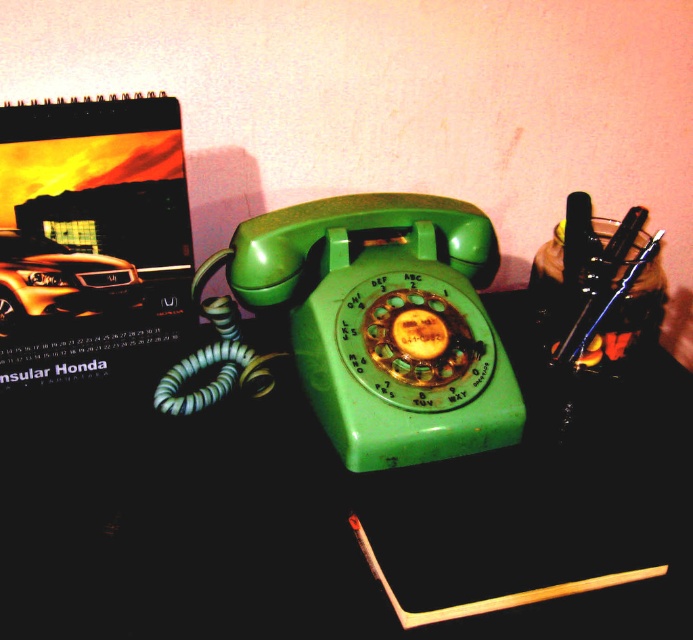
Question: Can you confirm if green plastic telephone at center is positioned to the right of wooden matchstick at lower center?

Choices:
 (A) yes
 (B) no

Answer: (B)

Question: Which point is closer to the camera?

Choices:
 (A) green plastic rotary phone at center
 (B) green plastic telephone at center
 (C) matte paper notebook at upper left
 (D) metallic orange car at upper left

Answer: (B)

Question: Observing the image, what is the correct spatial positioning of green plastic telephone at center in reference to metallic orange car at upper left?

Choices:
 (A) above
 (B) below

Answer: (B)

Question: Estimate the real-world distances between objects in this image. Which object is farther from the green plastic telephone at center?

Choices:
 (A) green plastic rotary phone at center
 (B) matte paper notebook at upper left

Answer: (B)

Question: Which of the following is the farthest from the observer?

Choices:
 (A) (x=245, y=376)
 (B) (x=53, y=266)
 (C) (x=114, y=232)

Answer: (A)

Question: Is green plastic telephone at center bigger than matte paper notebook at upper left?

Choices:
 (A) yes
 (B) no

Answer: (A)